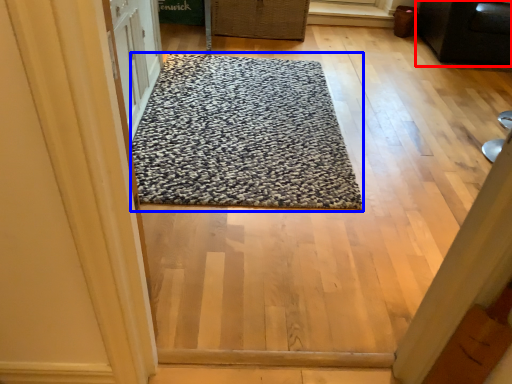
Question: Among these objects, which one is nearest to the camera, furniture (highlighted by a red box) or mat (highlighted by a blue box)?

Choices:
 (A) furniture
 (B) mat

Answer: (B)